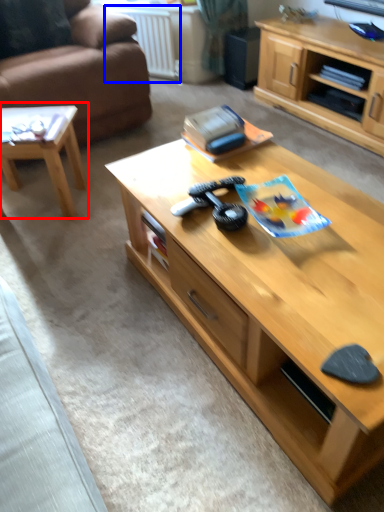
Question: Among these objects, which one is farthest to the camera, coffee table (highlighted by a red box) or radiator (highlighted by a blue box)?

Choices:
 (A) coffee table
 (B) radiator

Answer: (B)